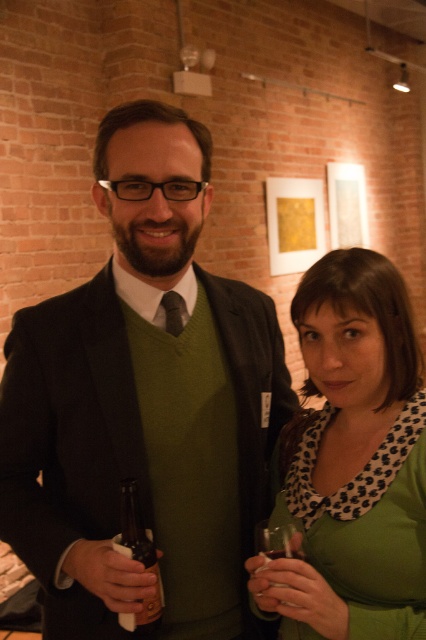
You are standing in a room with a matte green blouse at center. If you want to reach the blouse without moving your feet, can you do it?

The matte green blouse at center is 31.27 inches away from you, so you can reach it without moving your feet since this distance is within typical arm reach.

You are a photographer setting up a shot for a magazine cover. You need to ensure that the green matte sweater at center and the clear glass at right are both visible in the frame. Given their sizes, which object should you focus on first to ensure it fits within the camera frame?

The green matte sweater at center is taller than the clear glass at right, so you should focus on ensuring the green matte sweater at center fits first, as it requires more vertical space in the frame.

You are standing at the origin of the coordinate system in this scene. There are two points marked in the image. Which point is closer to you, point (334, 566) or point (138, 548)?

Point (138, 548) is closer to you because it is in front of point (334, 566).